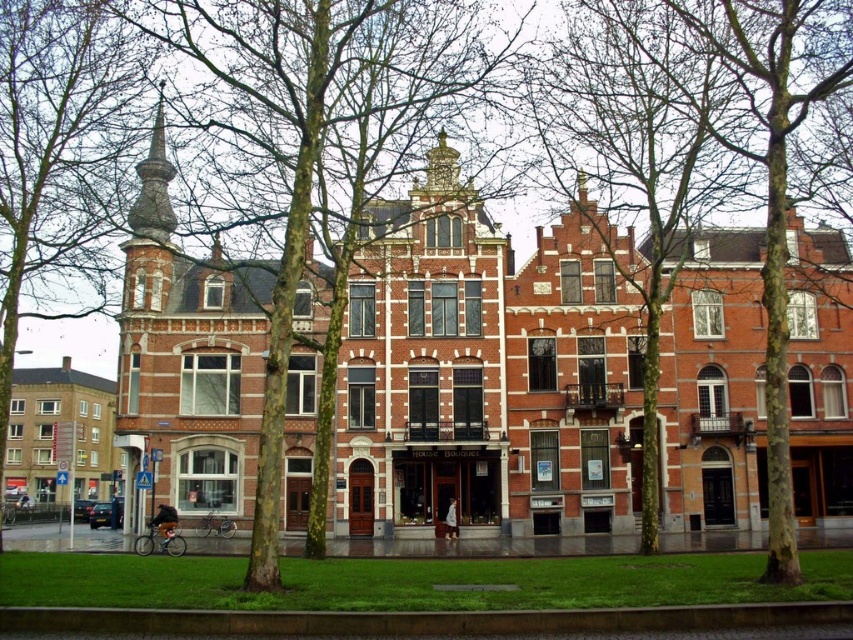
Question: Which object appears farthest from the camera in this image?

Choices:
 (A) smooth bark tree at left
 (B) smooth bark tree at center

Answer: (B)

Question: Does smooth bark tree at center come in front of smooth bark tree at left?

Choices:
 (A) no
 (B) yes

Answer: (A)

Question: Is green leafy tree at center above smooth bark tree at left?

Choices:
 (A) yes
 (B) no

Answer: (A)

Question: Does green leafy tree at center have a larger size compared to smooth bark tree at center?

Choices:
 (A) yes
 (B) no

Answer: (A)

Question: Estimate the real-world distances between objects in this image. Which object is closer to the green leafy tree at center?

Choices:
 (A) smooth bark tree at center
 (B) smooth bark tree at left

Answer: (B)

Question: Which object is farther from the camera taking this photo?

Choices:
 (A) smooth bark tree at center
 (B) green leafy tree at center

Answer: (A)